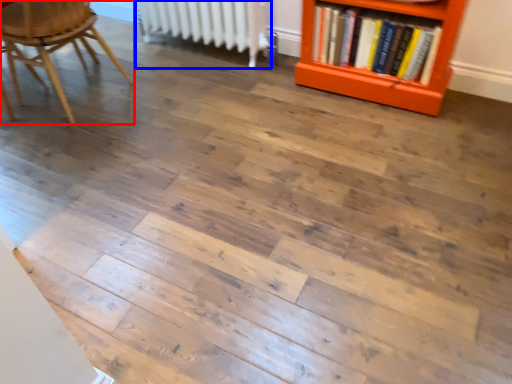
Question: Which object is further to the camera taking this photo, chair (highlighted by a red box) or radiator (highlighted by a blue box)?

Choices:
 (A) chair
 (B) radiator

Answer: (B)